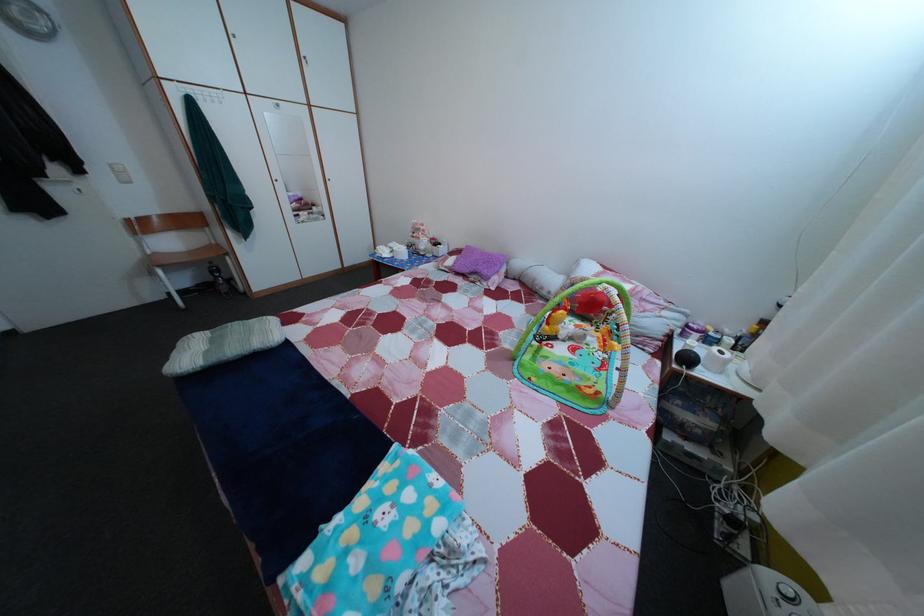
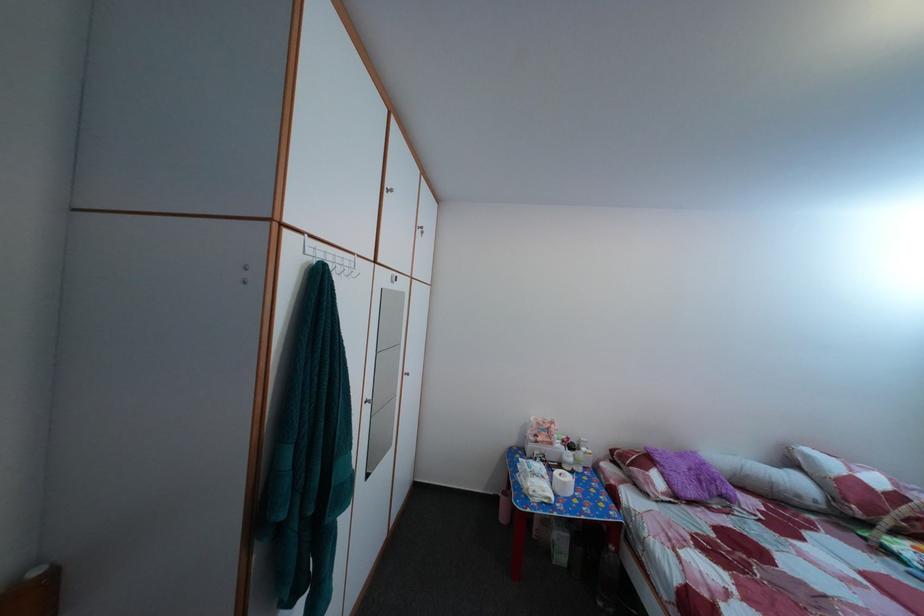
The point at (444, 246) is marked in the first image. Where is the corresponding point in the second image?

(578, 447)